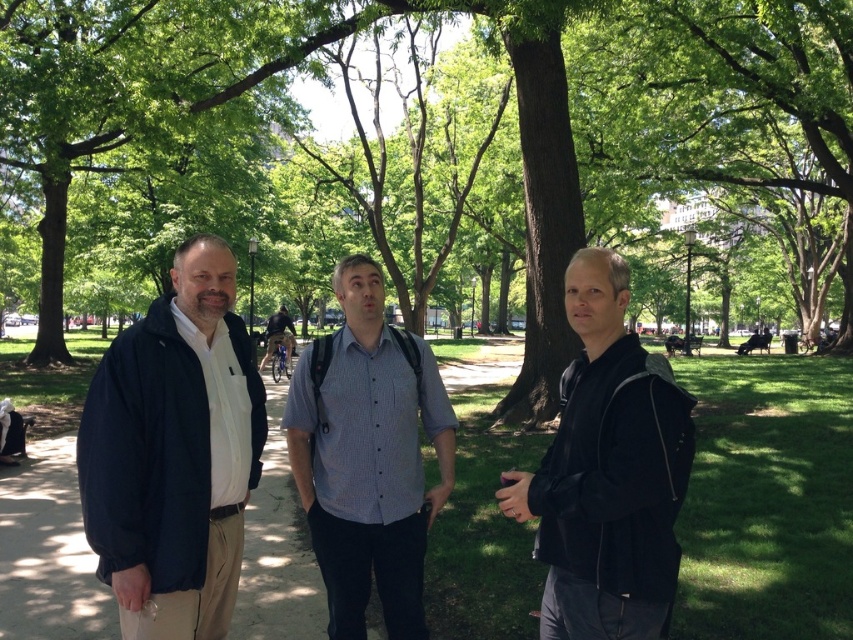
Based on the photo, can you confirm if dark blue jacket at center is positioned to the right of matte black jacket at left?

Result: Yes, dark blue jacket at center is to the right of matte black jacket at left.

Consider the image. Between dark blue jacket at center and matte black jacket at left, which one has more height?

Standing taller between the two is dark blue jacket at center.

Identify the location of dark blue jacket at center. This screenshot has width=853, height=640. (172, 454).

Locate an element on the screen. dark blue jacket at center is located at coordinates pyautogui.click(x=172, y=454).

Is black matte jacket at center to the left of dark blue shirt at center from the viewer's perspective?

Incorrect, black matte jacket at center is not on the left side of dark blue shirt at center.

From the picture: Is black matte jacket at center below dark blue shirt at center?

Indeed, black matte jacket at center is positioned under dark blue shirt at center.

Which is behind, point (560, 564) or point (286, 310)?

Point (286, 310)

At what (x,y) coordinates should I click in order to perform the action: click on black matte jacket at center. Please return your answer as a coordinate pair (x, y). Image resolution: width=853 pixels, height=640 pixels. Looking at the image, I should click on (607, 472).

What do you see at coordinates (173, 452) in the screenshot?
I see `matte black jacket at left` at bounding box center [173, 452].

Locate an element on the screen. The height and width of the screenshot is (640, 853). matte black jacket at left is located at coordinates (173, 452).